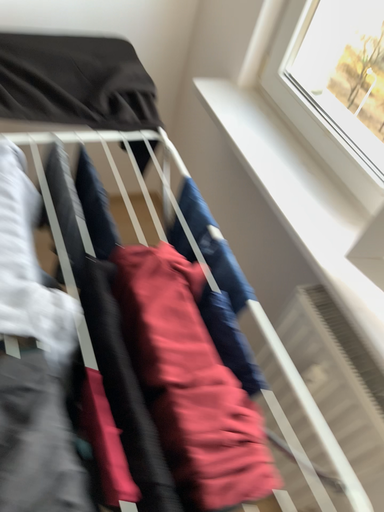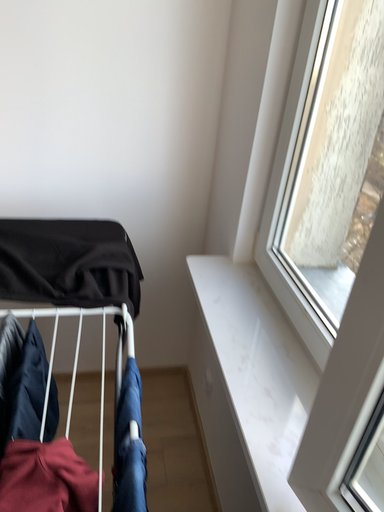
Question: How did the camera likely rotate when shooting the video?

Choices:
 (A) rotated upward
 (B) rotated downward

Answer: (A)